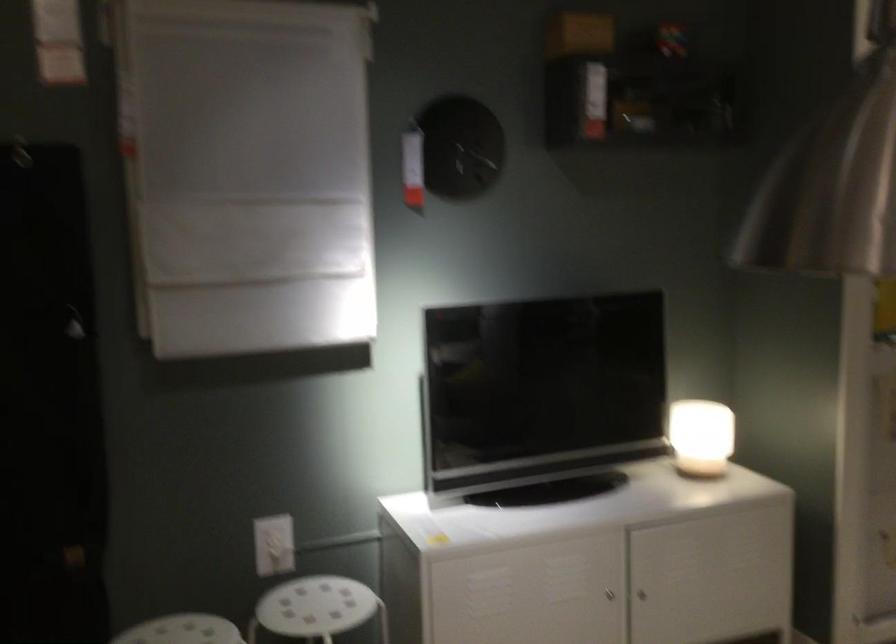
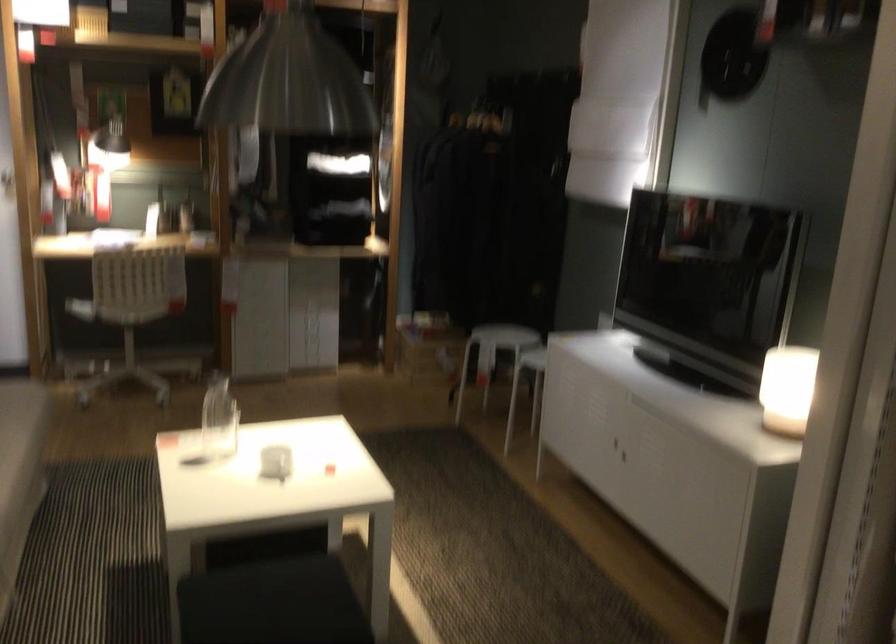
Question: I am providing you with two images of the same scene from different viewpoints. After the viewpoint changes to image2, which objects are now occluded?

Choices:
 (A) chair sitting surface
 (B) cabinet door handle
 (C) crate of bottles
 (D) glowing table lamp

Answer: (A)